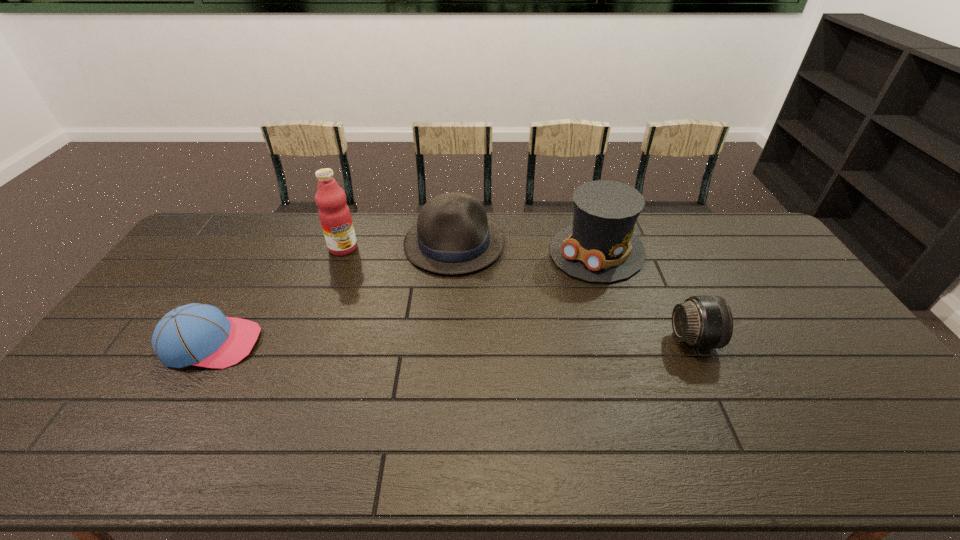
Locate an element on the screen. vacant area located on the front-facing side of the bowler hat is located at coordinates (457, 325).

Locate an element on the screen. This screenshot has width=960, height=540. blank area located 0.260m on the front-facing side of the bowler hat is located at coordinates (457, 338).

Where is `free space located on the front-facing side of the bowler hat`? This screenshot has height=540, width=960. free space located on the front-facing side of the bowler hat is located at coordinates (456, 305).

The image size is (960, 540). In order to click on free space located with goggles on the front of the fourth shortest object in this screenshot , I will do pos(557,291).

At what (x,y) coordinates should I click in order to perform the action: click on free spot located 0.240m with goggles on the front of the fourth shortest object. Please return your answer as a coordinate pair (x, y). Looking at the image, I should click on (530, 317).

Locate an element on the screen. The image size is (960, 540). vacant space situated with goggles on the front of the fourth shortest object is located at coordinates (519, 327).

At what (x,y) coordinates should I click in order to perform the action: click on free region located 0.120m on the label of the fruit juice. Please return your answer as a coordinate pair (x, y). Looking at the image, I should click on (356, 276).

You are a GUI agent. You are given a task and a screenshot of the screen. Output one action in this format:
    pyautogui.click(x=<x>, y=<y>)
    Task: Click on the free space located on the label of the fruit juice
    This screenshot has width=960, height=540.
    Given the screenshot: What is the action you would take?
    pyautogui.click(x=365, y=295)

Identify the location of free spot located 0.060m on the label of the fruit juice. (351, 266).

Where is `bowler hat positioned at the far edge`? The image size is (960, 540). bowler hat positioned at the far edge is located at coordinates (452, 235).